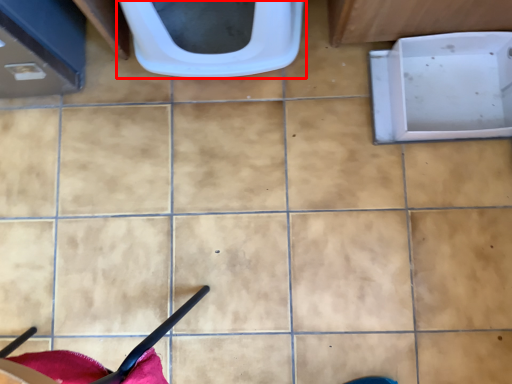
Question: From the image's perspective, where is toilet (annotated by the red box) located in relation to bath in the image?

Choices:
 (A) above
 (B) below

Answer: (A)